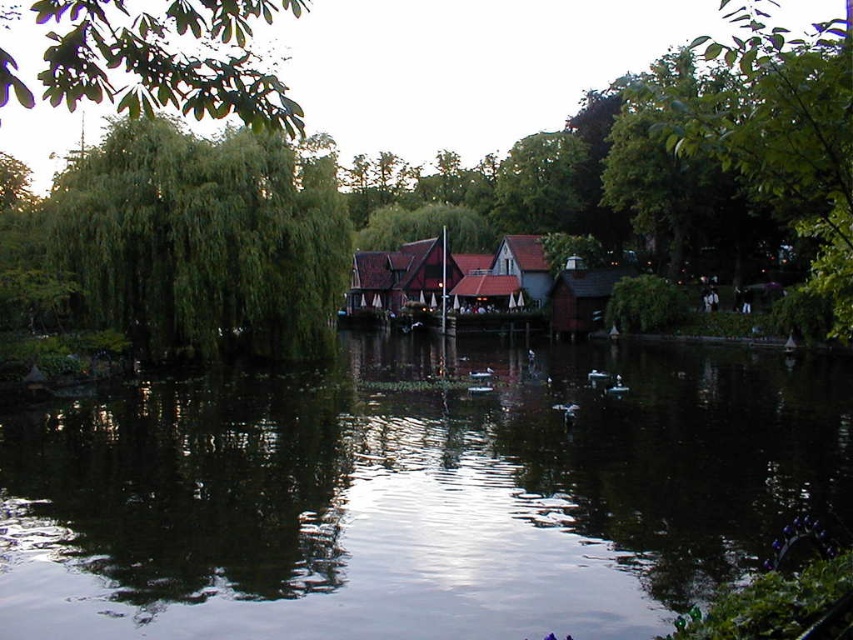
Can you confirm if wooden hut at center is positioned above brown wooden hut at center?

No.

Is point (589, 312) closer to camera compared to point (498, 305)?

Yes, point (589, 312) is in front of point (498, 305).

Image resolution: width=853 pixels, height=640 pixels. I want to click on wooden hut at center, so click(x=581, y=298).

Does point (221, 308) come farther from viewer compared to point (270, 100)?

Yes, it is behind point (270, 100).

Who is taller, green leafy tree at left or green leafy tree at upper left?

green leafy tree at upper left is taller.

Is point (309, 316) closer to viewer compared to point (194, 10)?

That is True.

I want to click on green leafy tree at left, so click(202, 241).

Does green leafy tree at center lie behind brown wooden hut at center?

No, green leafy tree at center is in front of brown wooden hut at center.

Who is positioned more to the left, green leafy tree at center or brown wooden hut at center?

green leafy tree at center

At what (x,y) coordinates should I click in order to perform the action: click on green leafy tree at center. Please return your answer as a coordinate pair (x, y). Looking at the image, I should click on (204, 237).